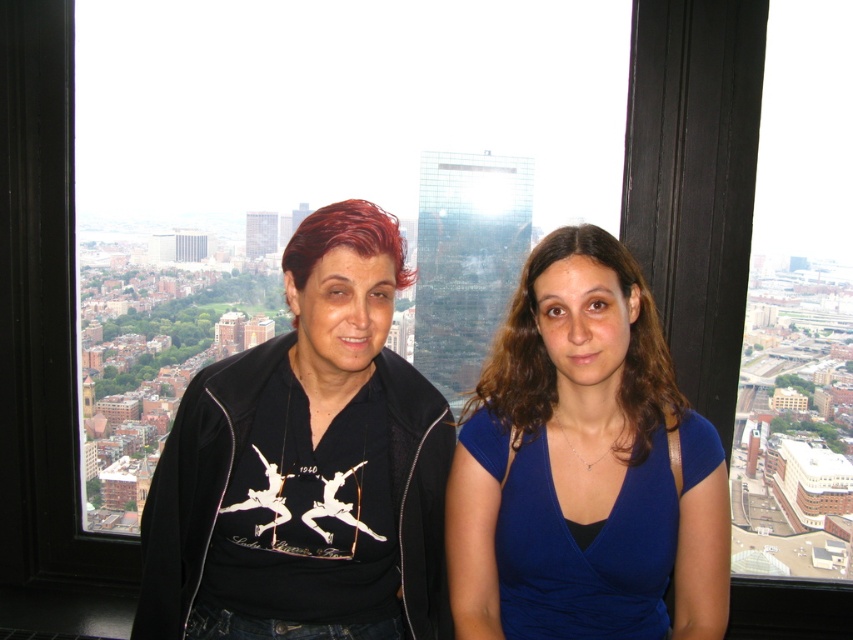
Who is shorter, black matte shirt at center or blue velvet dress at center?

With less height is black matte shirt at center.

Does black matte shirt at center appear under blue velvet dress at center?

Correct, black matte shirt at center is located below blue velvet dress at center.

Locate an element on the screen. black matte shirt at center is located at coordinates (584, 467).

You are a GUI agent. You are given a task and a screenshot of the screen. Output one action in this format:
    pyautogui.click(x=<x>, y=<y>)
    Task: Click on the black matte shirt at center
    
    Given the screenshot: What is the action you would take?
    pyautogui.click(x=584, y=467)